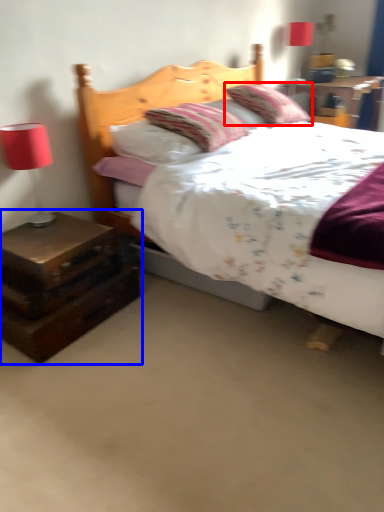
Question: Which point is closer to the camera, pillow (highlighted by a red box) or nightstand (highlighted by a blue box)?

Choices:
 (A) pillow
 (B) nightstand

Answer: (B)